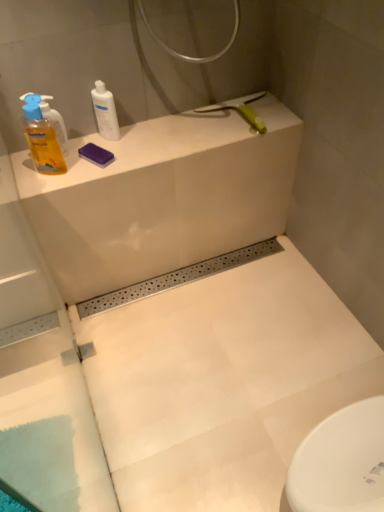
Locate an element on the screen. vacant space to the right of yellow translucent liquid at left, the 2th cleaning product from the right is located at coordinates (104, 161).